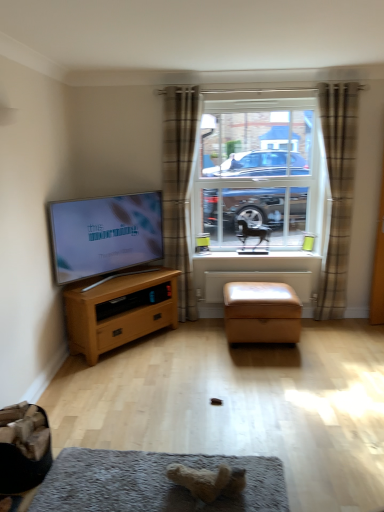
Where is `blank space above white painted wood at center (from a real-world perspective)`? The image size is (384, 512). blank space above white painted wood at center (from a real-world perspective) is located at coordinates (268, 250).